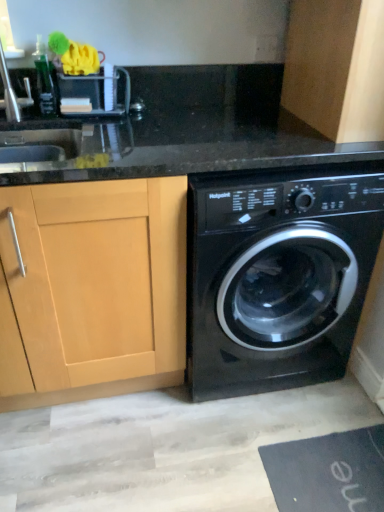
Locate an element on the screen. Image resolution: width=384 pixels, height=512 pixels. empty space that is ontop of light wood cabinet at left, positioned as the 1th cabinetry in left-to-right order is located at coordinates (99, 129).